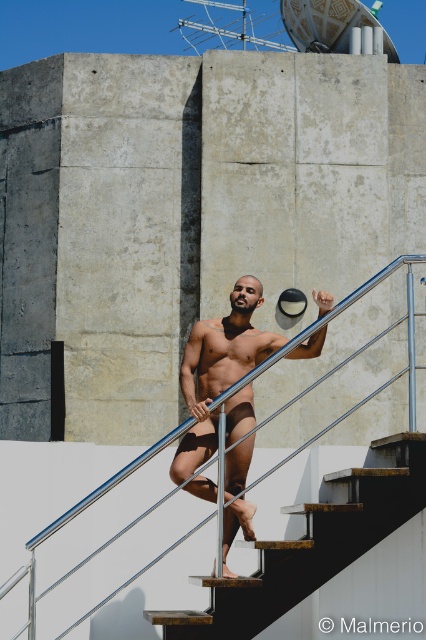
Can you confirm if matte black underwear at center is thinner than silver metallic rail at upper center?

Correct, matte black underwear at center's width is less than silver metallic rail at upper center's.

Does point (241, 426) come closer to viewer compared to point (40, 448)?

Yes, point (241, 426) is in front of point (40, 448).

Does point (267, 339) come closer to viewer compared to point (2, 627)?

No, it is behind (2, 627).

Find the location of a particular element. The width and height of the screenshot is (426, 640). matte black underwear at center is located at coordinates (218, 369).

Is wooden stair at center taller than matte black underwear at center?

In fact, wooden stair at center may be shorter than matte black underwear at center.

Between wooden stair at center and matte black underwear at center, which one is positioned higher?

matte black underwear at center is above.

I want to click on wooden stair at center, so click(x=313, y=547).

Can you confirm if wooden stair at center is taller than silver metallic rail at upper center?

No.

Find the location of a particular element. The image size is (426, 640). wooden stair at center is located at coordinates (313, 547).

This screenshot has height=640, width=426. Describe the element at coordinates (313, 547) in the screenshot. I see `wooden stair at center` at that location.

At what (x,y) coordinates should I click in order to perform the action: click on wooden stair at center. Please return your answer as a coordinate pair (x, y). Looking at the image, I should click on (313, 547).